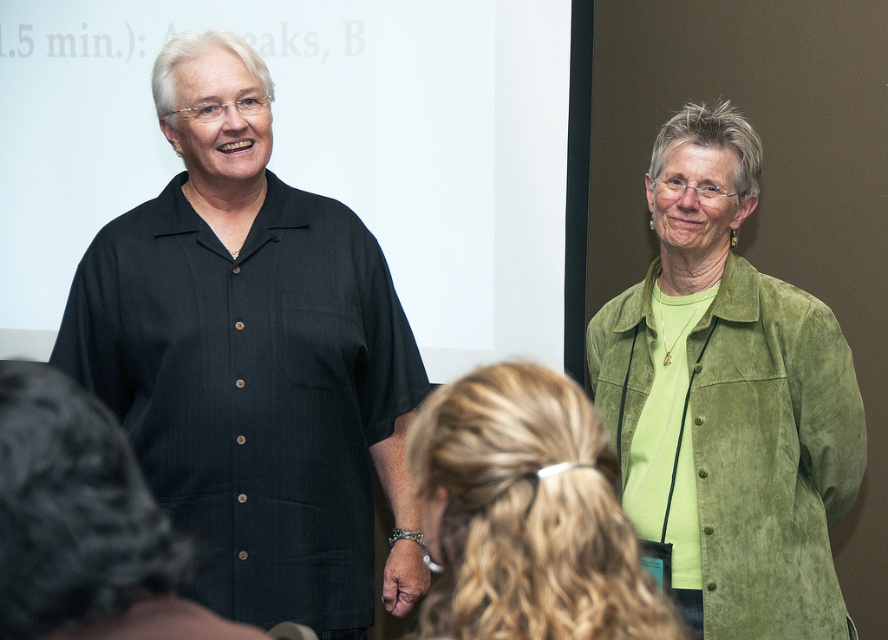
You are a photographer at the event and need to capture a photo of both the green suede jacket at center and the projection screen. The camera you are using has a maximum focus range of 40 inches. Can you take a photo of both subjects without moving the camera?

The distance between the green suede jacket at center and the projection screen is 37.54 inches, which is within the camera maximum focus range of 40 inches. So yes, you can take a photo of both subjects without moving the camera.

You are organizing a presentation and need to arrange two green suede items on a table. The items are the green suede jacket at center and the green suede shirt at right. Which item should you place first if you want to ensure there is enough space for both?

The green suede jacket at center is larger in size than the green suede shirt at right. Therefore, you should place the green suede jacket at center first to ensure there is enough space for both items.